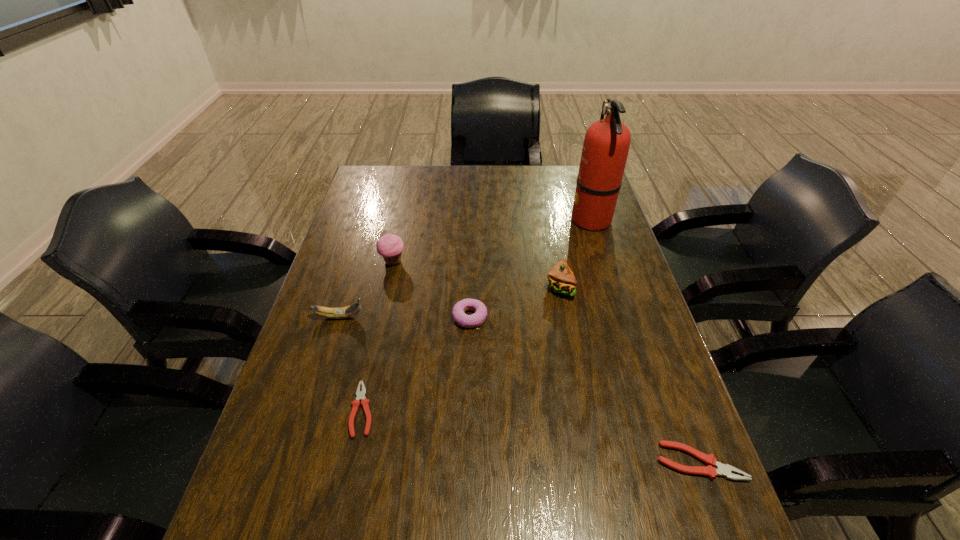
This screenshot has width=960, height=540. In order to click on doughnut in this screenshot , I will do coord(476,319).

This screenshot has height=540, width=960. I want to click on banana, so click(343, 312).

At what (x,y) coordinates should I click in order to perform the action: click on the fourth shortest object. Please return your answer as a coordinate pair (x, y). Image resolution: width=960 pixels, height=540 pixels. Looking at the image, I should click on point(343,312).

This screenshot has width=960, height=540. Find the location of `free space located on the right of the second nearest object`. free space located on the right of the second nearest object is located at coordinates (499, 409).

Locate an element on the screen. vacant region located on the left of the nearest object is located at coordinates 560,462.

Find the location of `free space located 0.120m on the left of the sixth nearest object`. free space located 0.120m on the left of the sixth nearest object is located at coordinates (341, 261).

The width and height of the screenshot is (960, 540). Find the location of `free space located 0.230m on the left of the third object from right to left`. free space located 0.230m on the left of the third object from right to left is located at coordinates (467, 287).

Image resolution: width=960 pixels, height=540 pixels. In order to click on vacant space situated on the side of the fire extinguisher with the nozzle and handle in this screenshot , I will do `click(494, 219)`.

Where is `vacant point located on the side of the fire extinguisher with the nozzle and handle`? vacant point located on the side of the fire extinguisher with the nozzle and handle is located at coordinates (518, 219).

Find the location of a particular element. Image resolution: width=960 pixels, height=540 pixels. free space located 0.360m on the side of the fire extinguisher with the nozzle and handle is located at coordinates (466, 219).